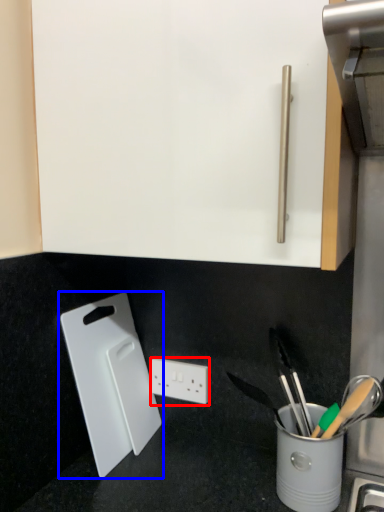
Question: Which object appears farthest to the camera in this image, power plugs and sockets (highlighted by a red box) or cutting board (highlighted by a blue box)?

Choices:
 (A) power plugs and sockets
 (B) cutting board

Answer: (A)